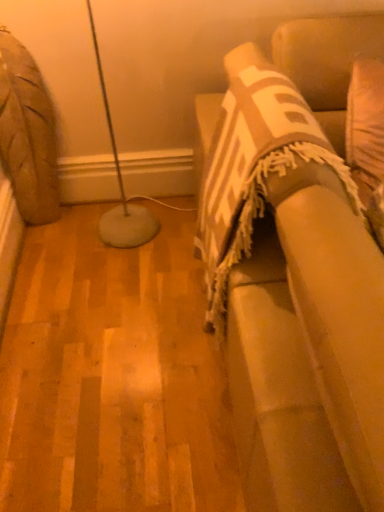
The width and height of the screenshot is (384, 512). In order to click on beige textured couch at right in this screenshot , I will do pyautogui.click(x=296, y=274).

This screenshot has width=384, height=512. What do you see at coordinates (296, 274) in the screenshot?
I see `beige textured couch at right` at bounding box center [296, 274].

You are a GUI agent. You are given a task and a screenshot of the screen. Output one action in this format:
    pyautogui.click(x=<x>, y=<y>)
    Task: Click on the beige textured couch at right
    The height and width of the screenshot is (512, 384).
    Given the screenshot: What is the action you would take?
    pyautogui.click(x=296, y=274)